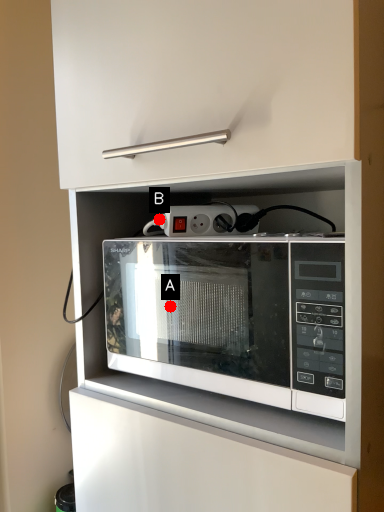
Question: Two points are circled on the image, labeled by A and B beside each circle. Which point appears farthest from the camera in this image?

Choices:
 (A) A is further
 (B) B is further

Answer: (A)